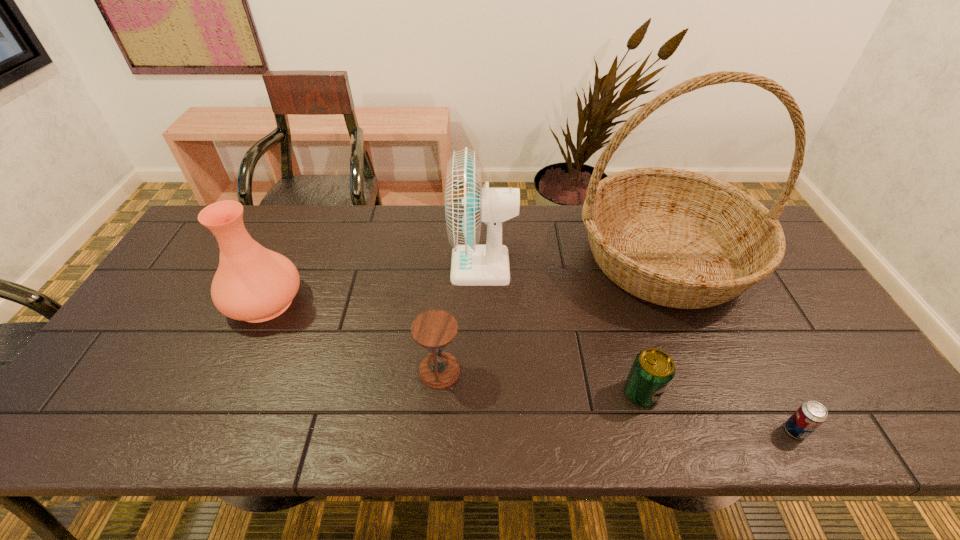
Image resolution: width=960 pixels, height=540 pixels. I want to click on vacant area that lies between the tallest object and the fifth shortest object, so click(x=573, y=263).

Identify the location of free area in between the basket and the second tallest object. (573, 263).

Locate an element on the screen. The height and width of the screenshot is (540, 960). vacant area that lies between the left beer can and the fifth shortest object is located at coordinates (562, 330).

Where is `free space between the nearer beer can and the farther beer can`? The image size is (960, 540). free space between the nearer beer can and the farther beer can is located at coordinates (718, 412).

This screenshot has width=960, height=540. Find the location of `object that is the third closest to the farther beer can`. object that is the third closest to the farther beer can is located at coordinates (467, 204).

Choose which object is the fifth nearest neighbor to the shorter beer can. Please provide its 2D coordinates. Your answer should be formatted as a tuple, i.e. [(x, y)], where the tuple contains the x and y coordinates of a point satisfying the conditions above.

[(254, 284)]

Find the location of a particular element. This screenshot has width=960, height=540. free region that satisfies the following two spatial constraints: 1. on the back side of the leftmost object; 2. on the left side of the tallest object is located at coordinates (285, 258).

In order to click on vacant region that satisfies the following two spatial constraints: 1. in front of the fan to face the airflow; 2. on the left side of the fifth tallest object in this screenshot , I will do `click(483, 394)`.

In order to click on vacant region that satisfies the following two spatial constraints: 1. in front of the fan to face the airflow; 2. on the front side of the hourglass in this screenshot , I will do `click(483, 371)`.

Locate an element on the screen. Image resolution: width=960 pixels, height=540 pixels. free space that satisfies the following two spatial constraints: 1. in front of the fan to face the airflow; 2. on the right side of the shorter beer can is located at coordinates (483, 430).